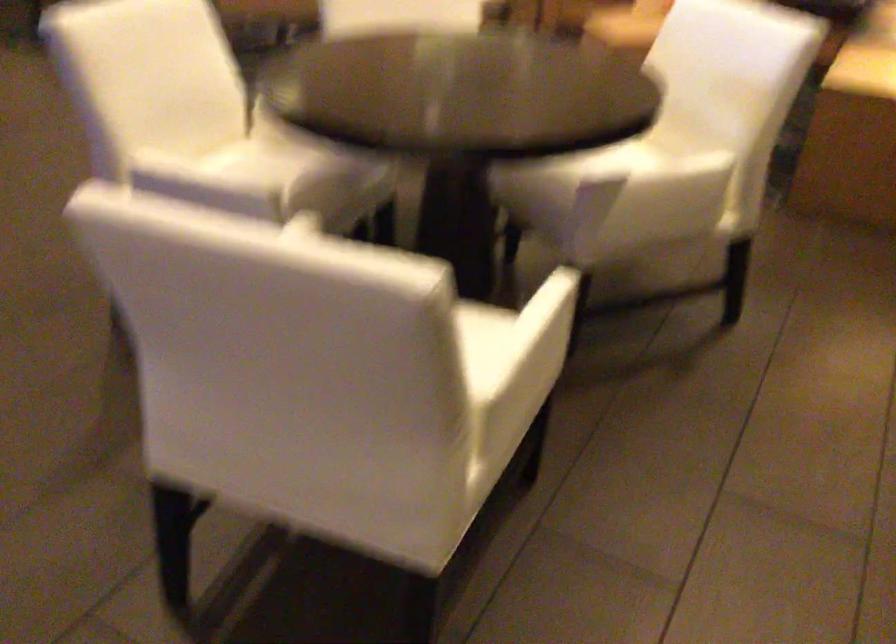
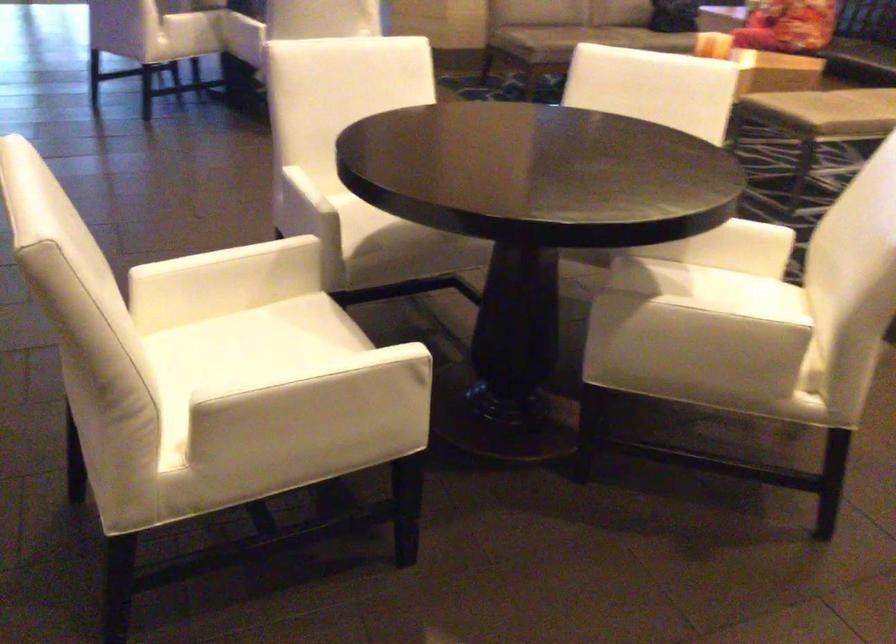
Where in the second image is the point corresponding to (x=519, y=330) from the first image?

(300, 373)